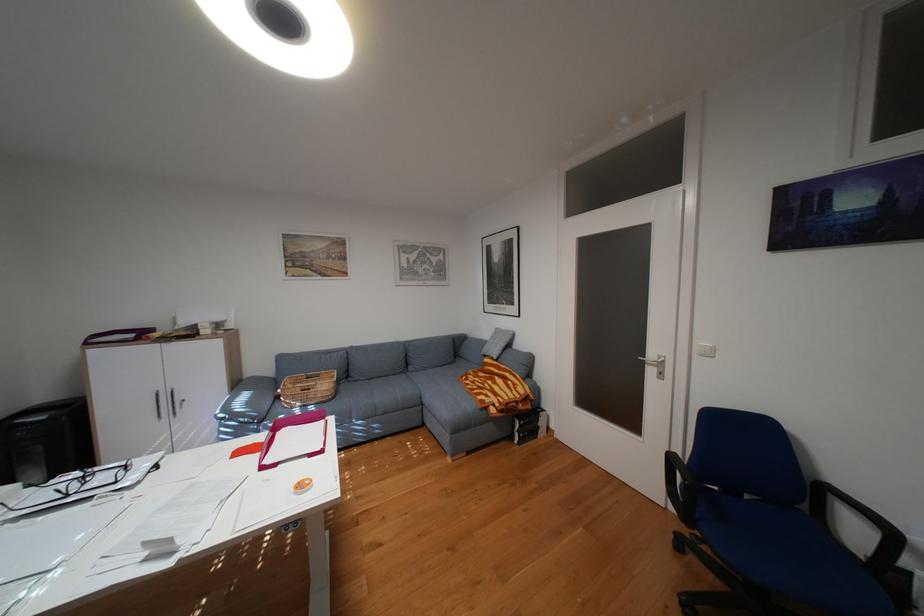
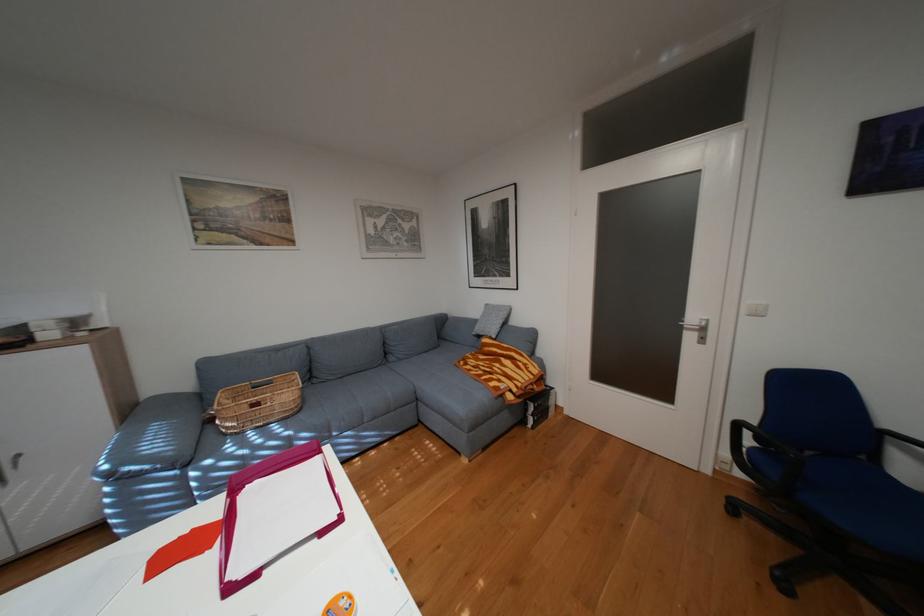
Question: The camera is either moving clockwise (left) or counter-clockwise (right) around the object. The first image is from the beginning of the video and the second image is from the end. Is the camera moving left or right when shooting the video?

Choices:
 (A) Left
 (B) Right

Answer: (A)